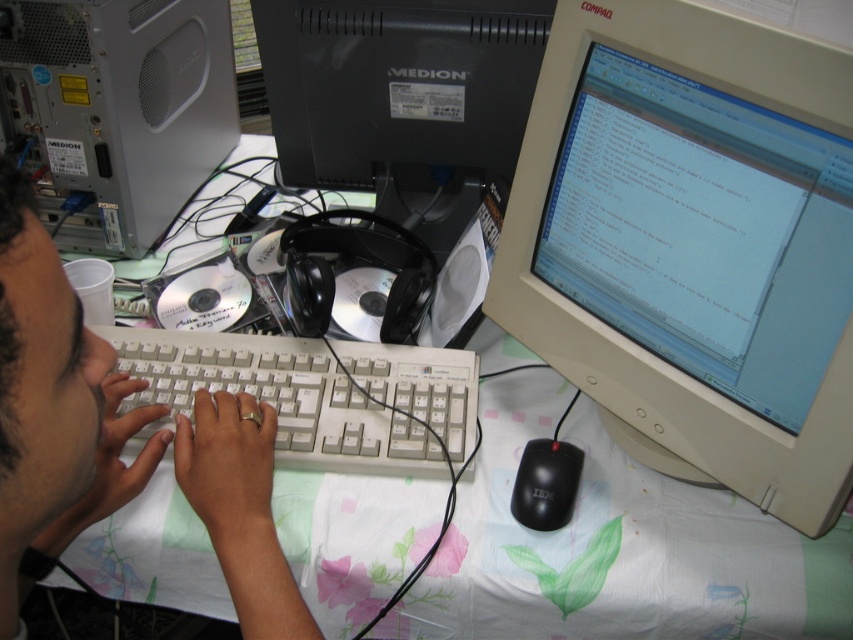
Does black plastic monitor at upper center have a lesser height compared to white plastic keyboard at center?

Incorrect, black plastic monitor at upper center's height does not fall short of white plastic keyboard at center's.

Based on the photo, which is below, black plastic monitor at upper center or white plastic keyboard at center?

white plastic keyboard at center is below.

Describe the element at coordinates (401, 99) in the screenshot. I see `black plastic monitor at upper center` at that location.

Find the location of a particular element. This screenshot has height=640, width=853. black plastic monitor at upper center is located at coordinates (401, 99).

Does point (190, 40) lie in front of point (577, 474)?

No, it is not.

Which is behind, point (88, 128) or point (550, 528)?

Point (88, 128)

At what (x,y) coordinates should I click in order to perform the action: click on white plastic computer tower at upper left. Please return your answer as a coordinate pair (x, y). Looking at the image, I should click on (117, 112).

The image size is (853, 640). What do you see at coordinates (115, 442) in the screenshot?
I see `light skin hands at center` at bounding box center [115, 442].

Is light skin hands at center taller than black plastic monitor at upper center?

Correct, light skin hands at center is much taller as black plastic monitor at upper center.

Where is `light skin hands at center`? light skin hands at center is located at coordinates (115, 442).

Locate an element on the screen. light skin hands at center is located at coordinates (115, 442).